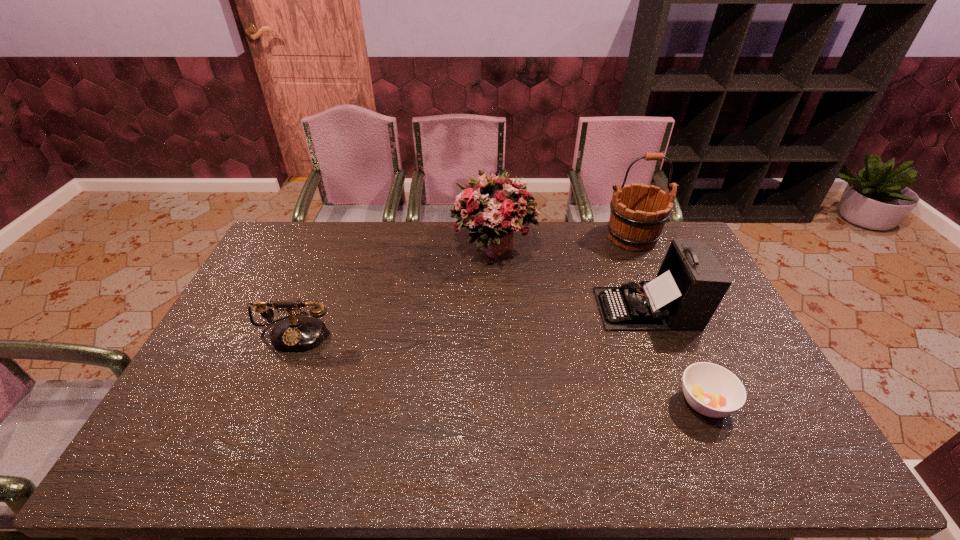
You are a GUI agent. You are given a task and a screenshot of the screen. Output one action in this format:
    pyautogui.click(x=<x>, y=<y>)
    Task: Click on the wine bucket
    This screenshot has height=540, width=960.
    Given the screenshot: What is the action you would take?
    pyautogui.click(x=638, y=214)

The image size is (960, 540). I want to click on bouquet, so click(494, 208).

Where is `the fourth shortest object`? the fourth shortest object is located at coordinates (494, 208).

Locate an element on the screen. The image size is (960, 540). typewriter is located at coordinates (690, 284).

Where is `the second shortest object`? This screenshot has height=540, width=960. the second shortest object is located at coordinates (295, 333).

What are the coordinates of `telephone` in the screenshot? It's located at (295, 333).

In order to click on the shortest object in this screenshot , I will do `click(712, 390)`.

Locate an element on the screen. Image resolution: width=960 pixels, height=540 pixels. the nearest object is located at coordinates (712, 390).

Identify the location of blank area located 0.170m on the front of the tallest object. This screenshot has width=960, height=540. (653, 286).

Locate an element on the screen. The image size is (960, 540). free space located 0.160m on the front of the fourth object from right to left is located at coordinates (496, 309).